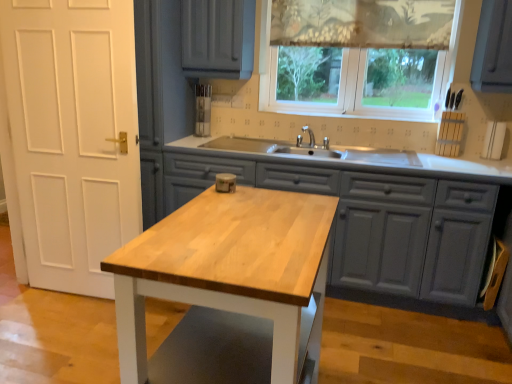
Describe the element at coordinates (362, 23) in the screenshot. The image size is (512, 384). I see `patterned fabric curtain at upper center` at that location.

Describe the element at coordinates (234, 245) in the screenshot. I see `light wood table at center` at that location.

What are the coordinates of `light wood table at center` in the screenshot? It's located at (234, 245).

This screenshot has height=384, width=512. Describe the element at coordinates (355, 58) in the screenshot. I see `translucent fabric at upper center` at that location.

What is the approximate height of translucent fabric at upper center?

translucent fabric at upper center is 95.61 centimeters in height.

Where is `patterned fabric curtain at upper center`? patterned fabric curtain at upper center is located at coordinates (362, 23).

Considering the positions of objects light wood table at center and translucent fabric at upper center in the image provided, who is more to the left, light wood table at center or translucent fabric at upper center?

light wood table at center is more to the left.

Considering the sizes of light wood table at center and translucent fabric at upper center in the image, is light wood table at center taller or shorter than translucent fabric at upper center?

In the image, light wood table at center appears to be shorter than translucent fabric at upper center.

Which is behind, point (305, 207) or point (302, 48)?

The point (302, 48) is more distant.

Between light wood table at center and translucent fabric at upper center, which one is positioned behind?

translucent fabric at upper center is more distant.

Identify the location of window on the right of wooden island at center. This screenshot has width=512, height=384. (355, 58).

Which of these two, translucent fabric at upper center or wooden island at center, is thinner?

translucent fabric at upper center.

From a real-world perspective, relative to wooden island at center, is translucent fabric at upper center vertically above or below?

translucent fabric at upper center is situated higher than wooden island at center in the real world.

Based on the photo, considering the sizes of translucent fabric at upper center and wooden island at center in the image, is translucent fabric at upper center taller or shorter than wooden island at center?

In the image, translucent fabric at upper center appears to be taller than wooden island at center.

Is wooden island at center surrounded by patterned fabric curtain at upper center?

No, patterned fabric curtain at upper center does not contain wooden island at center.

Find the location of `curtain above the wooden island at center (from the image's perspective)`. curtain above the wooden island at center (from the image's perspective) is located at coordinates (362, 23).

Between patterned fabric curtain at upper center and wooden island at center, which one appears on the left side from the viewer's perspective?

Positioned to the left is wooden island at center.

Considering the relative sizes of patterned fabric curtain at upper center and wooden island at center in the image provided, is patterned fabric curtain at upper center bigger than wooden island at center?

No.

Looking at this image, considering the relative sizes of wooden island at center and light wood table at center in the image provided, is wooden island at center shorter than light wood table at center?

Incorrect, the height of wooden island at center does not fall short of that of light wood table at center.

Consider the image. Is wooden island at center placed right next to light wood table at center?

No, wooden island at center is not making contact with light wood table at center.

Considering the positions of objects wooden island at center and light wood table at center in the image provided, who is behind, wooden island at center or light wood table at center?

wooden island at center is behind.

Which object is closer to the camera, patterned fabric curtain at upper center or light wood table at center?

light wood table at center.

Considering the relative sizes of patterned fabric curtain at upper center and light wood table at center in the image provided, is patterned fabric curtain at upper center wider than light wood table at center?

→ In fact, patterned fabric curtain at upper center might be narrower than light wood table at center.

Can you tell me how much patterned fabric curtain at upper center and light wood table at center differ in facing direction?

There is a 90.7-degree angle between the facing directions of patterned fabric curtain at upper center and light wood table at center.

Where is `curtain to the right of light wood table at center`? The width and height of the screenshot is (512, 384). curtain to the right of light wood table at center is located at coordinates (362, 23).

Which of these two, light wood table at center or patterned fabric curtain at upper center, is wider?

light wood table at center is wider.

From the image's perspective, is light wood table at center located above or below patterned fabric curtain at upper center?

Based on their image positions, light wood table at center is located beneath patterned fabric curtain at upper center.

Can we say light wood table at center lies outside patterned fabric curtain at upper center?

Yes, light wood table at center is located beyond the bounds of patterned fabric curtain at upper center.

Considering the positions of objects light wood table at center and patterned fabric curtain at upper center in the image provided, who is more to the right, light wood table at center or patterned fabric curtain at upper center?

patterned fabric curtain at upper center.

Is light wood table at center smaller than wooden island at center?

Yes, light wood table at center is smaller than wooden island at center.

Is point (236, 217) closer or farther from the camera than point (374, 239)?

Clearly, point (236, 217) is closer to the camera than point (374, 239).

Is light wood table at center not inside wooden island at center?

Yes, light wood table at center is outside of wooden island at center.

From their relative heights in the image, would you say light wood table at center is taller or shorter than wooden island at center?

Clearly, light wood table at center is shorter compared to wooden island at center.

Identify the location of countertop that appears in front of the translucent fabric at upper center. The image size is (512, 384). (234, 245).

You are a GUI agent. You are given a task and a screenshot of the screen. Output one action in this format:
    pyautogui.click(x=<x>, y=<y>)
    Task: Click on the cabinetry below the translucent fabric at upper center (from the image's perspective)
    
    Given the screenshot: What is the action you would take?
    pyautogui.click(x=373, y=223)

Considering their positions, is patterned fabric curtain at upper center positioned further to wooden island at center than light wood table at center?

patterned fabric curtain at upper center is further to wooden island at center.

Considering their positions, is wooden island at center positioned closer to translucent fabric at upper center than light wood table at center?

Among the two, wooden island at center is located nearer to translucent fabric at upper center.

Consider the image. Looking at the image, which one is located further to patterned fabric curtain at upper center, light wood table at center or wooden island at center?

light wood table at center is further to patterned fabric curtain at upper center.

Considering their positions, is translucent fabric at upper center positioned closer to patterned fabric curtain at upper center than wooden island at center?

translucent fabric at upper center lies closer to patterned fabric curtain at upper center than the other object.

Looking at the image, which one is located closer to light wood table at center, wooden island at center or patterned fabric curtain at upper center?

wooden island at center.

Looking at the image, which one is located closer to light wood table at center, patterned fabric curtain at upper center or translucent fabric at upper center?

translucent fabric at upper center.

Based on their spatial positions, is patterned fabric curtain at upper center or light wood table at center further from translucent fabric at upper center?

The object further to translucent fabric at upper center is light wood table at center.

Looking at the image, which one is located further to wooden island at center, translucent fabric at upper center or light wood table at center?

light wood table at center lies further to wooden island at center than the other object.

Where is `window between light wood table at center and patterned fabric curtain at upper center from front to back`? This screenshot has width=512, height=384. window between light wood table at center and patterned fabric curtain at upper center from front to back is located at coordinates (355, 58).

Locate an element on the screen. cabinetry positioned between light wood table at center and translucent fabric at upper center from near to far is located at coordinates (373, 223).

Locate an element on the screen. window between patterned fabric curtain at upper center and wooden island at center in the vertical direction is located at coordinates (355, 58).

Image resolution: width=512 pixels, height=384 pixels. I want to click on cabinetry located between light wood table at center and patterned fabric curtain at upper center in the depth direction, so click(x=373, y=223).